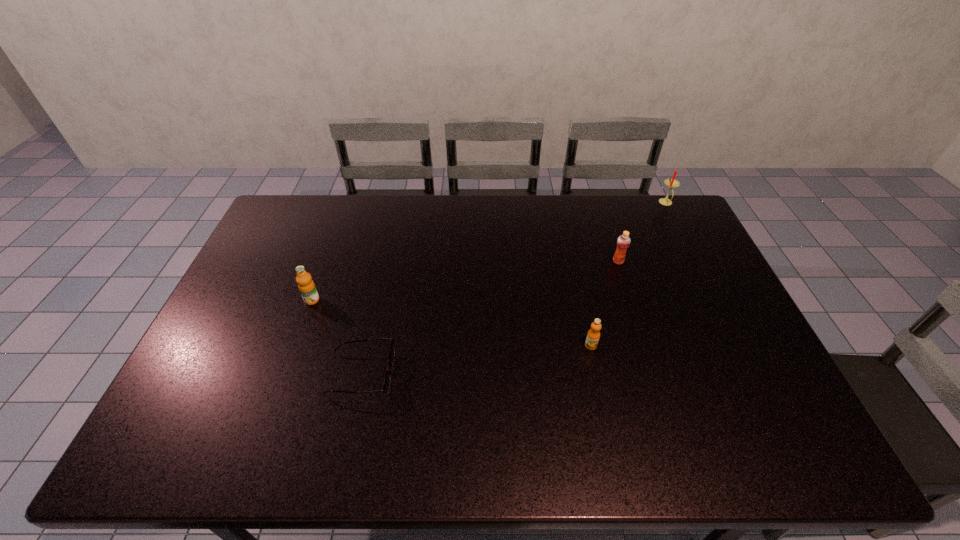
At what (x,y) coordinates should I click in order to perform the action: click on the farthest object. Please return your answer as a coordinate pair (x, y). The height and width of the screenshot is (540, 960). Looking at the image, I should click on (671, 183).

What are the coordinates of `the rightmost object` in the screenshot? It's located at (671, 183).

Image resolution: width=960 pixels, height=540 pixels. In order to click on the leftmost object in this screenshot , I will do `click(306, 286)`.

This screenshot has height=540, width=960. I want to click on the leftmost orange juice, so click(306, 286).

Locate an element on the screen. This screenshot has width=960, height=540. the fourth nearest object is located at coordinates (623, 242).

Find the location of a particular element. This screenshot has width=960, height=540. the rightmost orange juice is located at coordinates 623,242.

Find the location of a particular element. the shortest orange juice is located at coordinates pyautogui.click(x=593, y=335).

Identify the location of the second orange juice from left to right. (593, 335).

Find the location of a particular element. The height and width of the screenshot is (540, 960). the shortest object is located at coordinates (386, 386).

You are a GUI agent. You are given a task and a screenshot of the screen. Output one action in this format:
    pyautogui.click(x=<x>, y=<y>)
    Task: Click on the second object from left to right
    The image size is (960, 540).
    Given the screenshot: What is the action you would take?
    pyautogui.click(x=386, y=386)